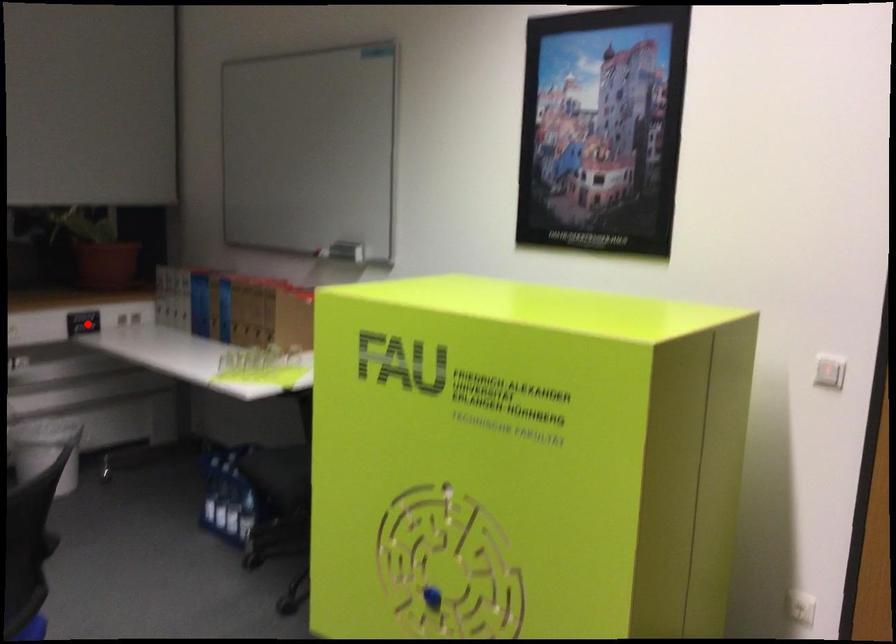
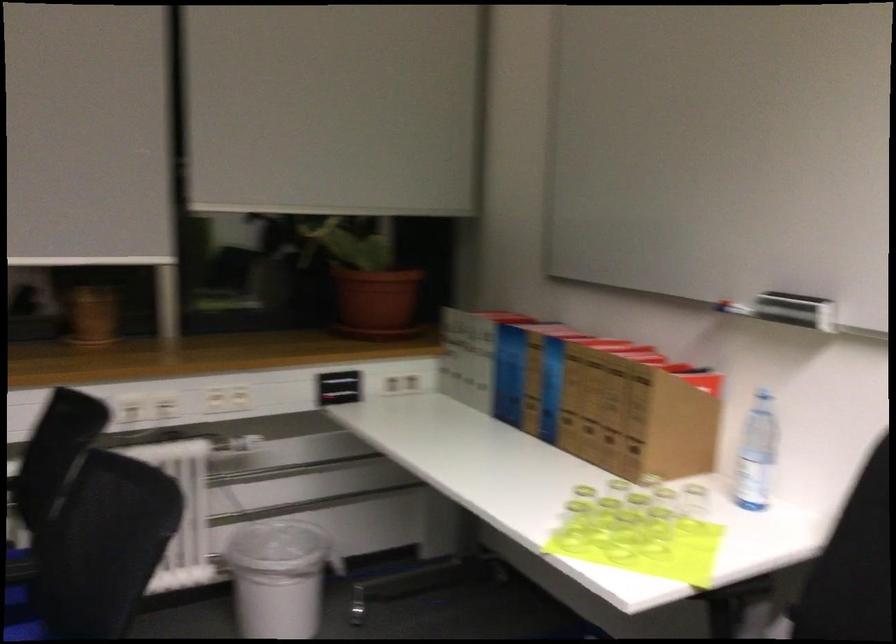
Question: I am providing you with two images of the same scene from different viewpoints. A red point is marked on the first image. At the location where the point appears in image 1, is it still visible in image 2?

Choices:
 (A) Yes
 (B) No

Answer: (A)